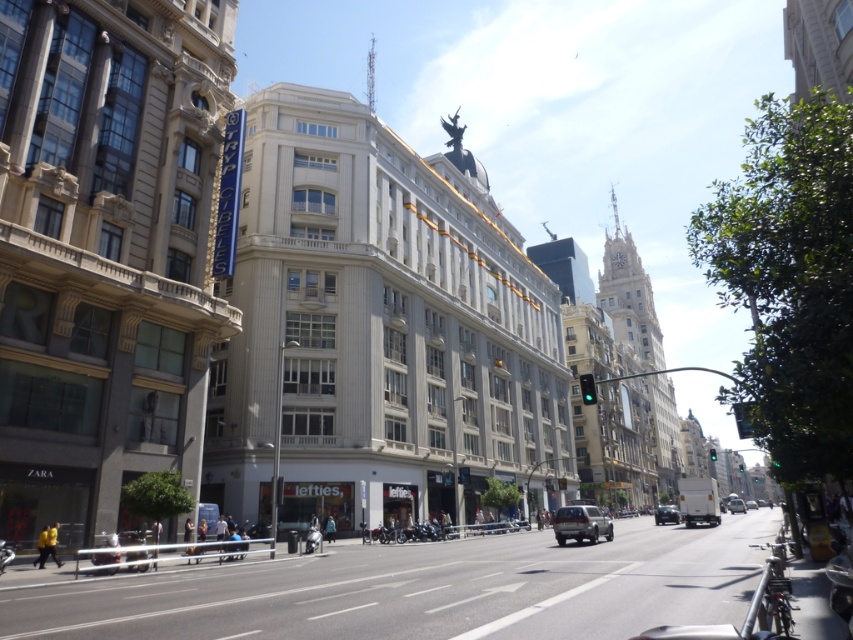
Question: Which object appears farthest from the camera in this image?

Choices:
 (A) silver metallic suv at center
 (B) metallic silver car at center
 (C) silver metallic van at center

Answer: (C)

Question: Does silver metallic suv at center come in front of silver metallic van at center?

Choices:
 (A) no
 (B) yes

Answer: (B)

Question: Based on their relative distances, which object is nearer to the metallic silver car at center?

Choices:
 (A) silver metallic suv at center
 (B) silver metallic van at center

Answer: (B)

Question: In this image, where is metallic silver car at center located relative to silver metallic van at center?

Choices:
 (A) below
 (B) above

Answer: (B)

Question: Does metallic silver car at center have a greater width compared to silver metallic van at center?

Choices:
 (A) yes
 (B) no

Answer: (A)

Question: Which of the following is the farthest from the observer?

Choices:
 (A) (728, 506)
 (B) (666, 516)
 (C) (583, 522)

Answer: (A)